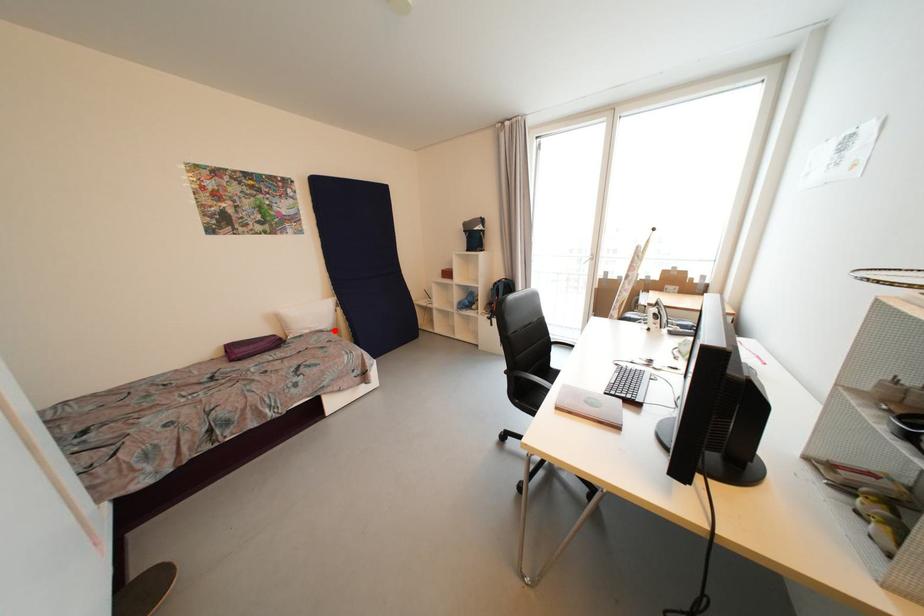
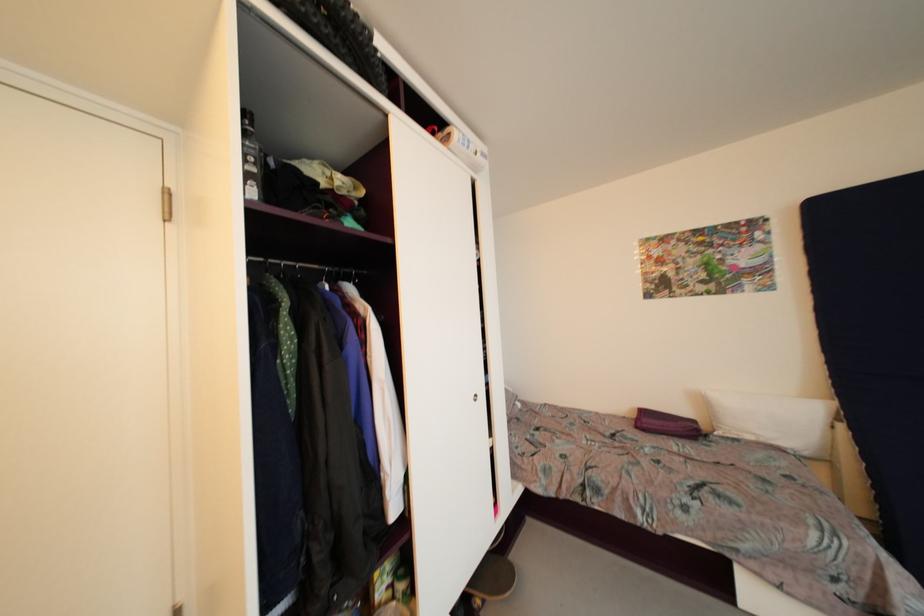
Question: I am providing you with two images of the same scene from different viewpoints. Image1 has a red point marked. In image2, the corresponding 3D location appears at what relative position? Reply with the corresponding letter.

Choices:
 (A) Closer
 (B) Farther

Answer: (B)